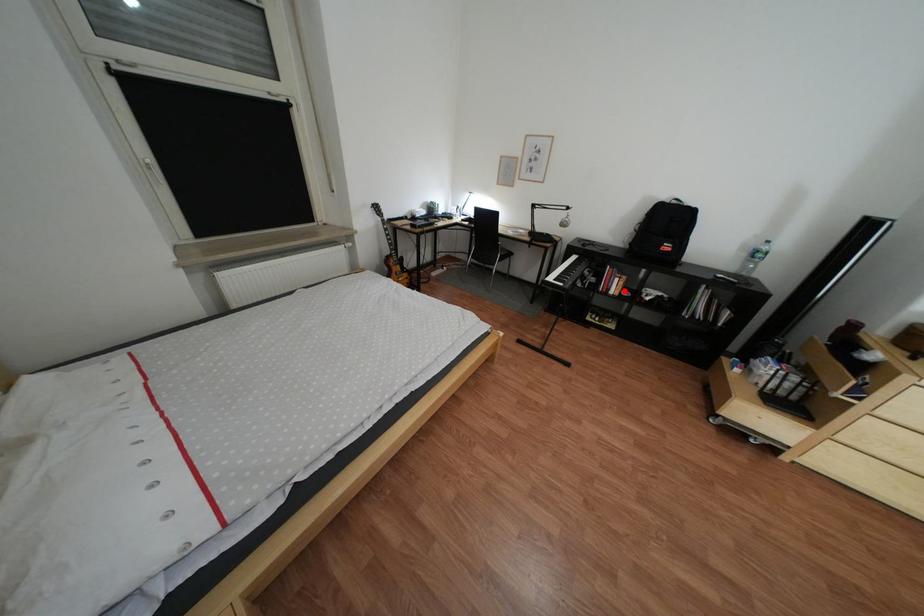
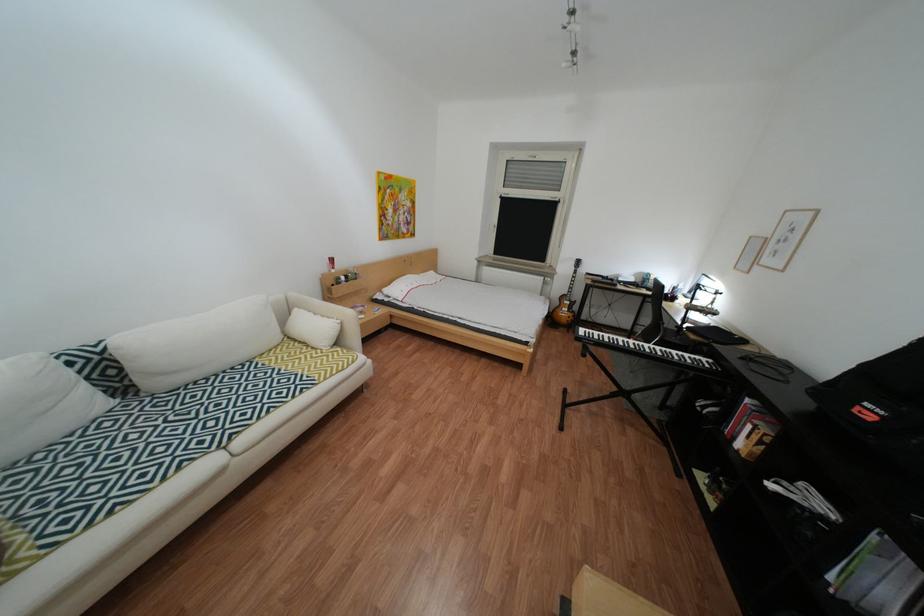
The point at the highlighted location is marked in the first image. Where is the corresponding point in the second image?

(749, 439)